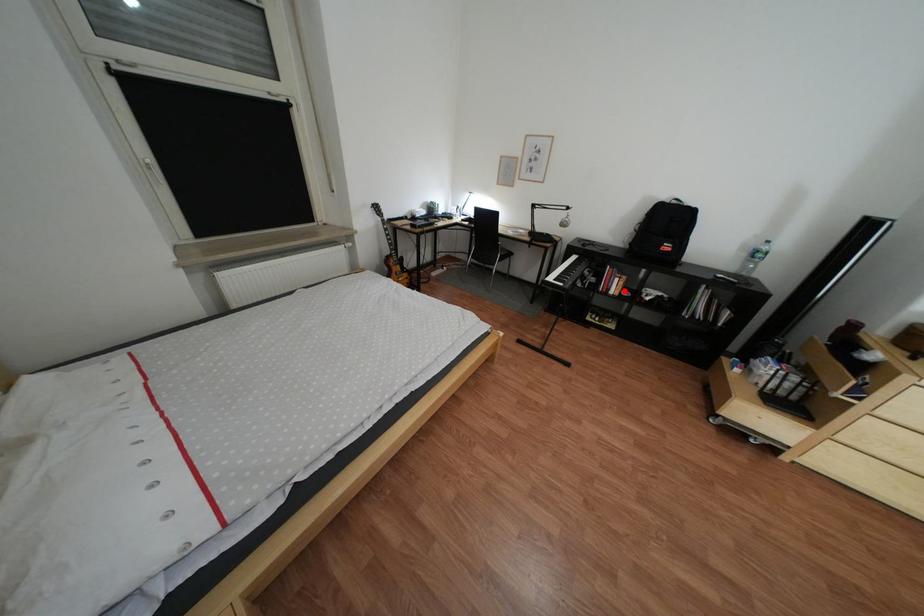
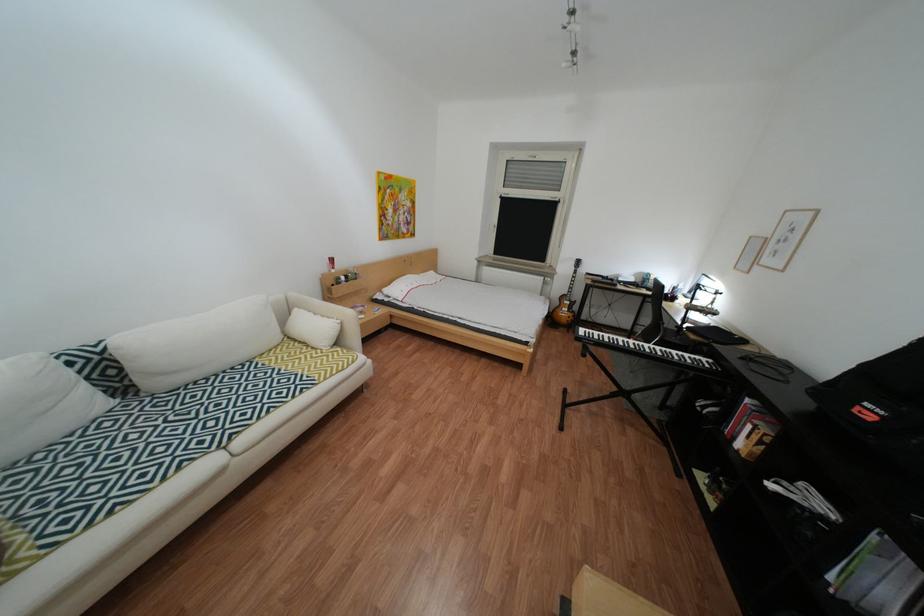
The point at the highlighted location is marked in the first image. Where is the corresponding point in the second image?

(749, 439)